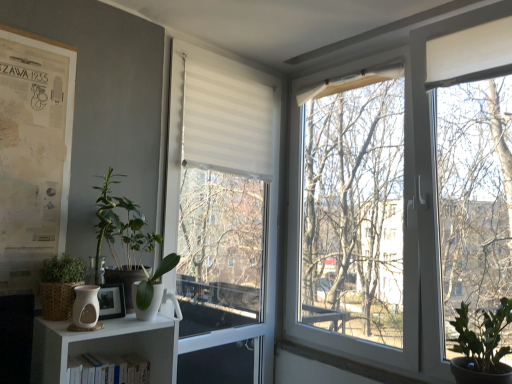
Question: Does green matte plant at lower right, the third vegetation positioned from the left, have a larger size compared to matte white vase at lower left?

Choices:
 (A) no
 (B) yes

Answer: (B)

Question: Is green matte plant at lower right, the 1th vegetation in the right-to-left sequence, completely or partially outside of matte white vase at lower left?

Choices:
 (A) yes
 (B) no

Answer: (A)

Question: Considering the relative sizes of green matte plant at lower right, the 1th vegetation in the right-to-left sequence, and matte white vase at lower left in the image provided, is green matte plant at lower right, the 1th vegetation in the right-to-left sequence, thinner than matte white vase at lower left?

Choices:
 (A) yes
 (B) no

Answer: (B)

Question: Considering the relative positions of green matte plant at lower right, the third vegetation positioned from the left, and matte white vase at lower left in the image provided, is green matte plant at lower right, the third vegetation positioned from the left, to the left of matte white vase at lower left from the viewer's perspective?

Choices:
 (A) no
 (B) yes

Answer: (A)

Question: Can you confirm if green matte plant at lower right, the 1th vegetation in the right-to-left sequence, is shorter than matte white vase at lower left?

Choices:
 (A) no
 (B) yes

Answer: (A)

Question: From a real-world perspective, is white matte window at center above or below white matte bookshelf at lower left?

Choices:
 (A) below
 (B) above

Answer: (B)

Question: Relative to white matte bookshelf at lower left, is white matte window at center in front or behind?

Choices:
 (A) behind
 (B) front

Answer: (A)

Question: Based on their positions, is white matte window at center located to the left or right of white matte bookshelf at lower left?

Choices:
 (A) left
 (B) right

Answer: (B)

Question: Is white matte window at center inside the boundaries of white matte bookshelf at lower left, or outside?

Choices:
 (A) inside
 (B) outside

Answer: (B)

Question: From a real-world perspective, is white matte bookshelf at lower left physically located above or below wooden picture frame at lower left?

Choices:
 (A) below
 (B) above

Answer: (A)

Question: From the image's perspective, is white matte bookshelf at lower left above or below wooden picture frame at lower left?

Choices:
 (A) above
 (B) below

Answer: (B)

Question: Which is correct: white matte bookshelf at lower left is inside wooden picture frame at lower left, or outside of it?

Choices:
 (A) inside
 (B) outside

Answer: (B)

Question: Considering the positions of white matte bookshelf at lower left and wooden picture frame at lower left in the image, is white matte bookshelf at lower left bigger or smaller than wooden picture frame at lower left?

Choices:
 (A) big
 (B) small

Answer: (A)

Question: Based on their positions, is white matte bookshelf at lower left located to the left or right of white matte window at center?

Choices:
 (A) right
 (B) left

Answer: (B)

Question: From a real-world perspective, is white matte bookshelf at lower left positioned above or below white matte window at center?

Choices:
 (A) below
 (B) above

Answer: (A)